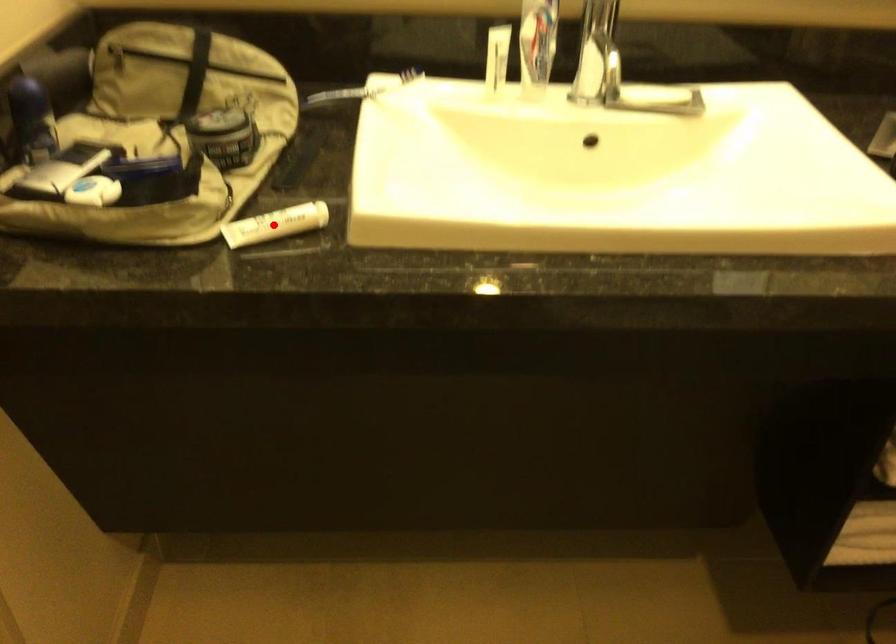
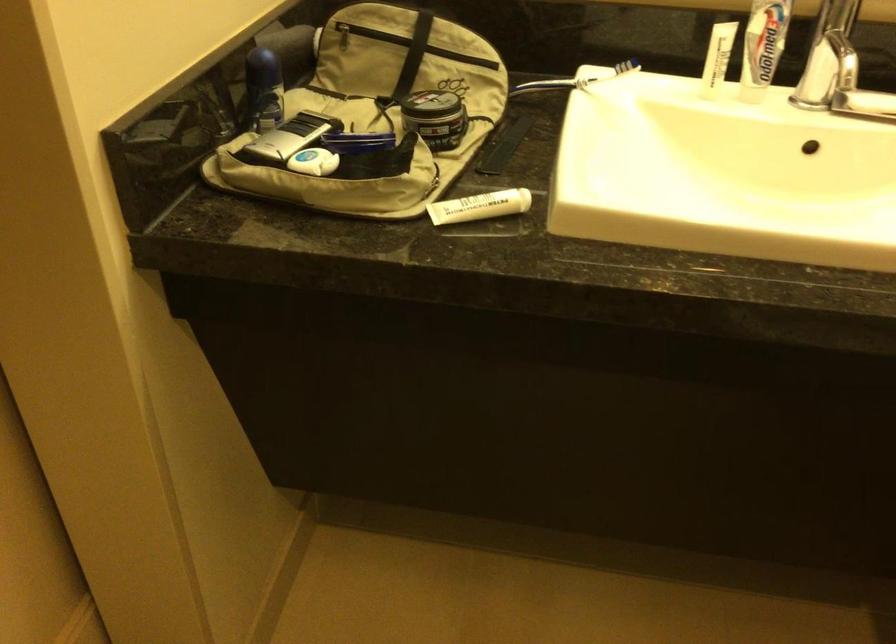
Find the pixel in the second image that matches the highlighted location in the first image.

(479, 205)